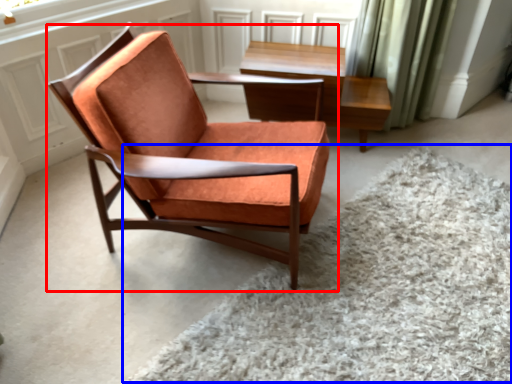
Question: Which of the following is the closest to the observer, chair (highlighted by a red box) or plain (highlighted by a blue box)?

Choices:
 (A) chair
 (B) plain

Answer: (B)